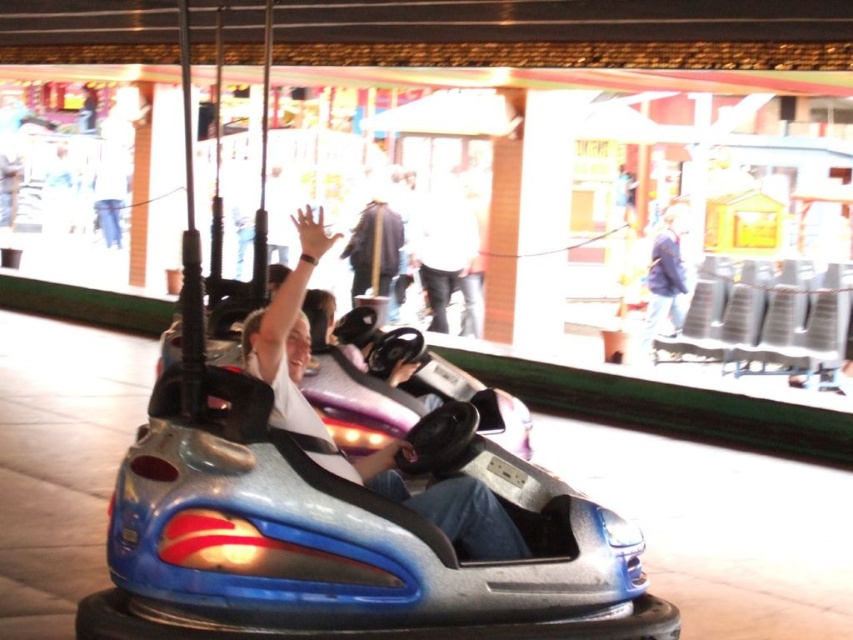
You are at the fairground and want to take a photo of the bumper car ride. You notice the matte white shirt at center and the blue fabric jacket at upper right. Which object is closer to the camera?

The matte white shirt at center is positioned under the blue fabric jacket at upper right, meaning the blue fabric jacket at upper right is closer to the camera.

You are observing the bumper car ride from the side. You notice two items in the scene described as the matte white shirt at center and the blue fabric jacket at upper right. Which of these items is shorter in height?

The matte white shirt at center has a lesser height compared to the blue fabric jacket at upper right, so the matte white shirt at center is shorter in height.